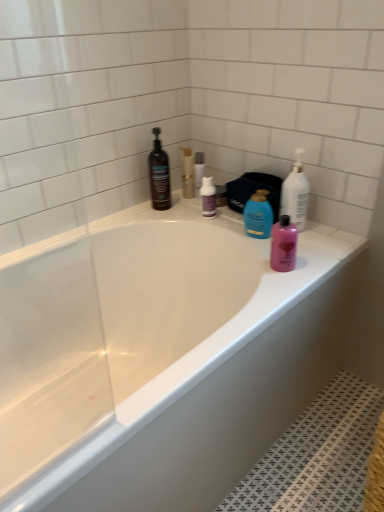
The image size is (384, 512). What are the coordinates of `vacant space to the right of blue glossy bottle at upper center, placed as the 3th cleaning product when sorted from left to right` in the screenshot? It's located at (321, 240).